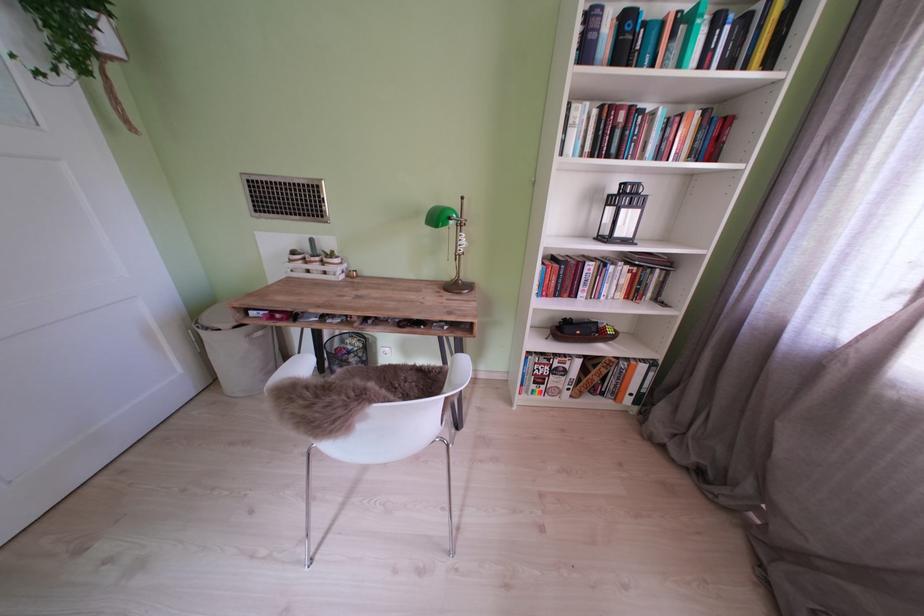
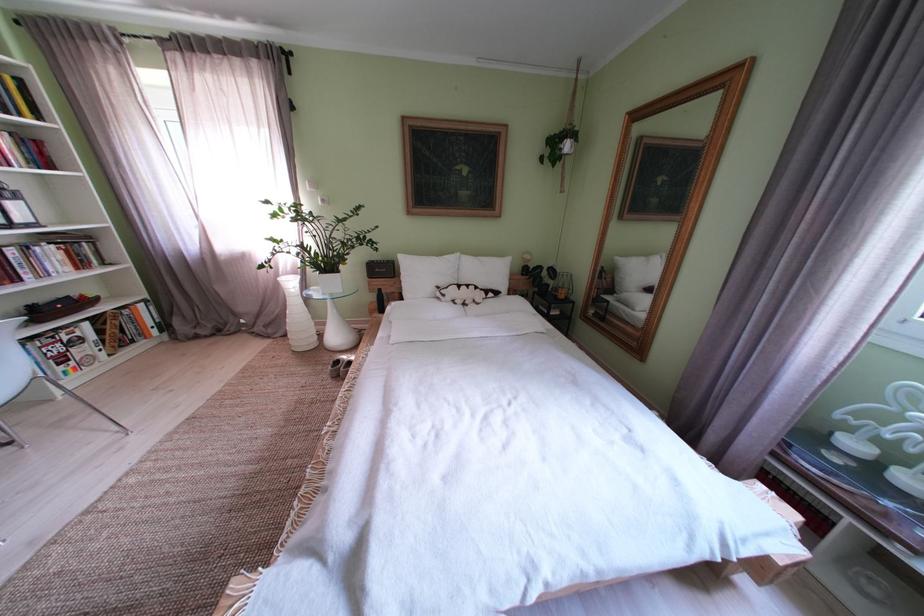
In the second image, find the point that corresponds to [576,377] in the first image.

(92, 344)